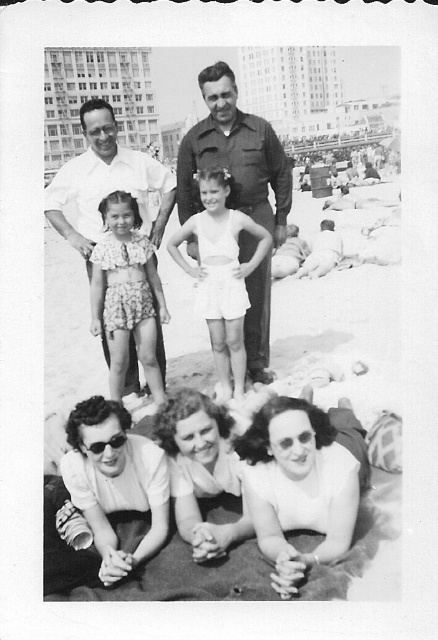
Can you confirm if matte white swimsuit at lower center is thinner than dark green uniform at center?

Indeed, matte white swimsuit at lower center has a lesser width compared to dark green uniform at center.

Does point (303, 452) come in front of point (237, 154)?

That is True.

I want to click on matte white swimsuit at lower center, so click(x=301, y=483).

How much distance is there between matte white swimsuit at lower center and white cotton shirt at upper left?

matte white swimsuit at lower center is 16.89 meters from white cotton shirt at upper left.

Can you confirm if matte white swimsuit at lower center is positioned to the right of white cotton shirt at upper left?

Correct, you'll find matte white swimsuit at lower center to the right of white cotton shirt at upper left.

The height and width of the screenshot is (640, 438). What do you see at coordinates (301, 483) in the screenshot?
I see `matte white swimsuit at lower center` at bounding box center [301, 483].

Locate an element on the screen. Image resolution: width=438 pixels, height=640 pixels. matte white swimsuit at lower center is located at coordinates (301, 483).

Which is more to the left, dark green uniform at center or white cotton shirt at upper left?

Positioned to the left is white cotton shirt at upper left.

Which is below, dark green uniform at center or white cotton shirt at upper left?

dark green uniform at center is below.

Locate an element on the screen. Image resolution: width=438 pixels, height=640 pixels. dark green uniform at center is located at coordinates (235, 156).